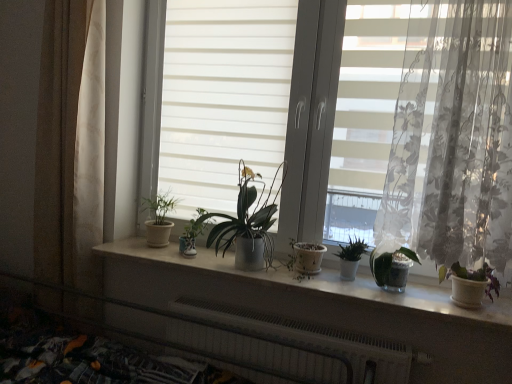
Question: From a real-world perspective, is beige fabric curtain at left, the second curtain positioned from the right, located higher than purple matte plant at right, which is the first houseplant in right-to-left order?

Choices:
 (A) no
 (B) yes

Answer: (B)

Question: Is beige fabric curtain at left, the second curtain positioned from the right, to the left of purple matte plant at right, which is the first houseplant in right-to-left order, from the viewer's perspective?

Choices:
 (A) no
 (B) yes

Answer: (B)

Question: Is beige fabric curtain at left, the second curtain in the front-to-back sequence, behind purple matte plant at right, which is the first houseplant in right-to-left order?

Choices:
 (A) no
 (B) yes

Answer: (B)

Question: Is beige fabric curtain at left, the second curtain in the front-to-back sequence, oriented towards purple matte plant at right, the sixth houseplant from the left?

Choices:
 (A) yes
 (B) no

Answer: (B)

Question: Is beige fabric curtain at left, the second curtain positioned from the right, surrounding purple matte plant at right, the sixth houseplant from the left?

Choices:
 (A) yes
 (B) no

Answer: (B)

Question: Is white ceramic window sill at center a part of beige fabric curtain at left, the second curtain positioned from the right?

Choices:
 (A) yes
 (B) no

Answer: (B)

Question: Is beige fabric curtain at left, the second curtain positioned from the right, shorter than white ceramic window sill at center?

Choices:
 (A) no
 (B) yes

Answer: (A)

Question: From a real-world perspective, is beige fabric curtain at left, which appears as the 1th curtain when viewed from the back, under white ceramic window sill at center?

Choices:
 (A) no
 (B) yes

Answer: (A)

Question: Is beige fabric curtain at left, which appears as the 1th curtain when viewed from the back, beside white ceramic window sill at center?

Choices:
 (A) yes
 (B) no

Answer: (B)

Question: Considering the relative positions of beige fabric curtain at left, the second curtain positioned from the right, and white ceramic window sill at center in the image provided, is beige fabric curtain at left, the second curtain positioned from the right, behind white ceramic window sill at center?

Choices:
 (A) no
 (B) yes

Answer: (B)

Question: Can you confirm if beige fabric curtain at left, the second curtain in the front-to-back sequence, is taller than white ceramic window sill at center?

Choices:
 (A) yes
 (B) no

Answer: (A)

Question: From a real-world perspective, is green matte plant at center, which appears as the fourth houseplant when viewed from the left, positioned under green matte plant at center, arranged as the fifth houseplant when viewed from the right, based on gravity?

Choices:
 (A) yes
 (B) no

Answer: (B)